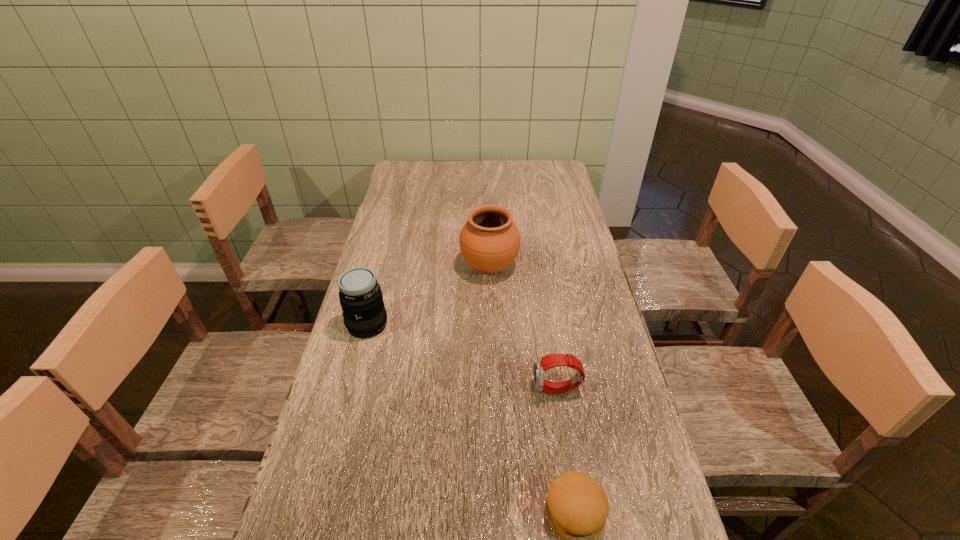
This screenshot has width=960, height=540. In order to click on vacant space situated 0.320m on the face of the third tallest object in this screenshot , I will do `click(404, 390)`.

Locate an element on the screen. The width and height of the screenshot is (960, 540). object present at the left edge is located at coordinates (360, 296).

Identify the location of object at the right edge. (541, 364).

You are a GUI agent. You are given a task and a screenshot of the screen. Output one action in this format:
    pyautogui.click(x=<x>, y=<y>)
    Task: Click on the free space at the far edge of the desktop
    The height and width of the screenshot is (540, 960).
    Given the screenshot: What is the action you would take?
    pyautogui.click(x=447, y=171)

In the image, there is a desktop. Where is `free space at the left edge`? This screenshot has height=540, width=960. free space at the left edge is located at coordinates (354, 498).

The width and height of the screenshot is (960, 540). I want to click on blank space at the right edge of the desktop, so click(541, 199).

The image size is (960, 540). I want to click on vacant space at the far left corner of the desktop, so click(x=419, y=178).

In order to click on vacant region between the third nearest object and the farthest object in this screenshot , I will do `click(428, 295)`.

At what (x,y) coordinates should I click in order to perform the action: click on free spot between the telephoto lens and the second shortest object. Please return your answer as a coordinate pair (x, y). Looking at the image, I should click on (462, 357).

Identify the location of unoccupied area between the third tallest object and the third nearest object. (462, 357).